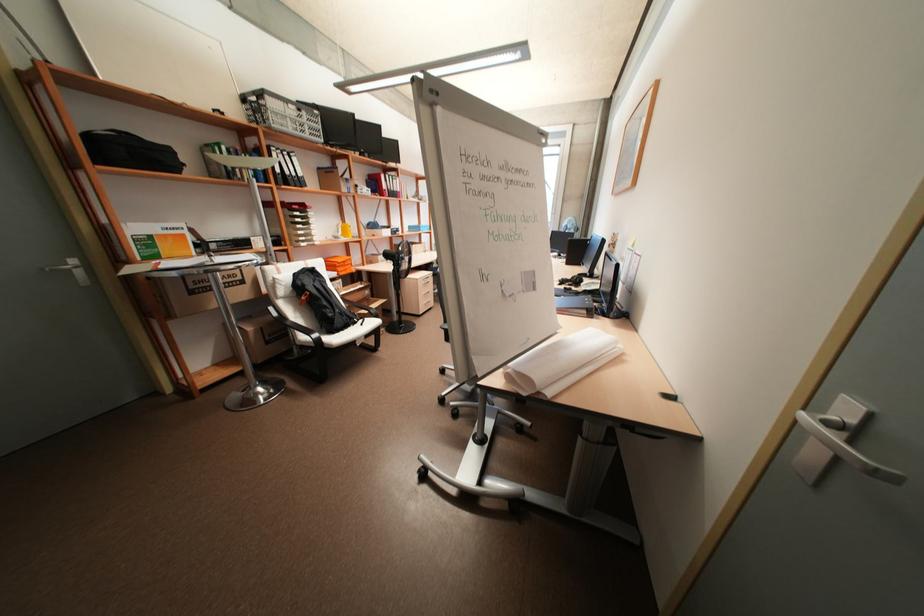
This screenshot has height=616, width=924. Describe the element at coordinates (297, 169) in the screenshot. I see `the black binder` at that location.